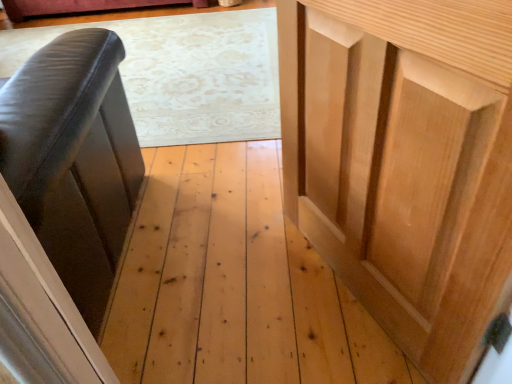
Question: From the image's perspective, is natural wood cupboard at right located above or below black leather couch at left?

Choices:
 (A) below
 (B) above

Answer: (A)

Question: Looking at their shapes, would you say natural wood cupboard at right is wider or thinner than black leather couch at left?

Choices:
 (A) wide
 (B) thin

Answer: (B)

Question: Is point (346, 144) positioned closer to the camera than point (39, 94)?

Choices:
 (A) farther
 (B) closer

Answer: (A)

Question: Relative to natural wood cupboard at right, is black leather couch at left in front or behind?

Choices:
 (A) front
 (B) behind

Answer: (B)

Question: Considering the positions of black leather couch at left and natural wood cupboard at right in the image, is black leather couch at left bigger or smaller than natural wood cupboard at right?

Choices:
 (A) big
 (B) small

Answer: (A)

Question: Is black leather couch at left inside or outside of natural wood cupboard at right?

Choices:
 (A) inside
 (B) outside

Answer: (B)

Question: Does point (53, 102) appear closer or farther from the camera than point (364, 208)?

Choices:
 (A) farther
 (B) closer

Answer: (B)